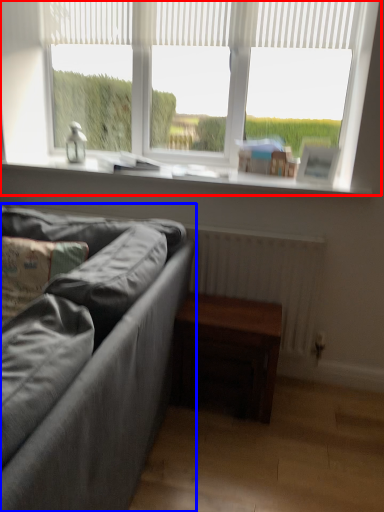
Question: Which object is further to the camera taking this photo, window (highlighted by a red box) or studio couch (highlighted by a blue box)?

Choices:
 (A) window
 (B) studio couch

Answer: (A)